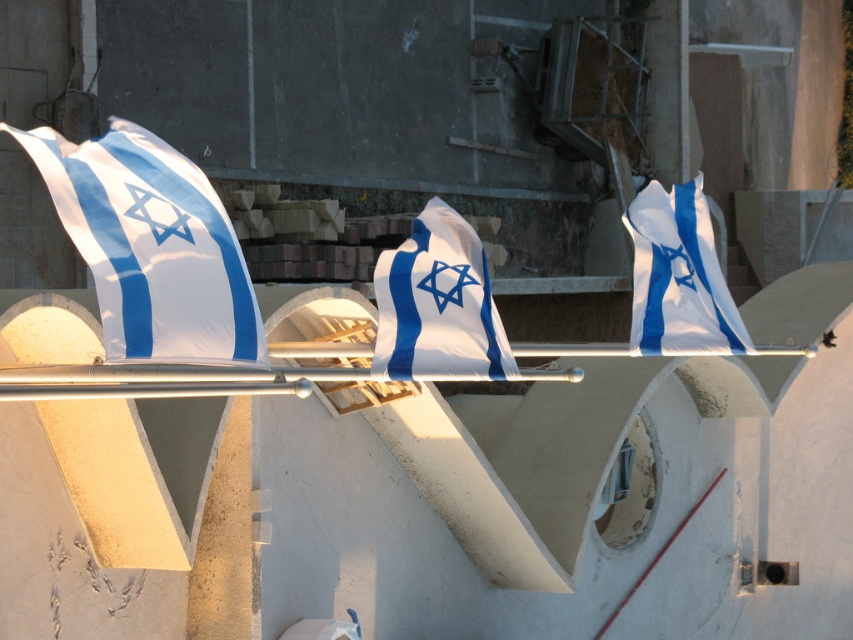
Question: Which of the following is the closest to the observer?

Choices:
 (A) white fabric flag at center
 (B) white fabric flag at right

Answer: (A)

Question: Is white fabric flag at left bigger than white fabric flag at right?

Choices:
 (A) no
 (B) yes

Answer: (A)

Question: Among these objects, which one is farthest from the camera?

Choices:
 (A) white fabric flag at left
 (B) white fabric flag at center

Answer: (B)

Question: Does white fabric flag at left appear over white fabric flag at right?

Choices:
 (A) yes
 (B) no

Answer: (B)

Question: Estimate the real-world distances between objects in this image. Which object is farther from the white fabric flag at left?

Choices:
 (A) white fabric flag at center
 (B) white fabric flag at right

Answer: (B)

Question: Is white fabric flag at left thinner than white fabric flag at right?

Choices:
 (A) yes
 (B) no

Answer: (A)